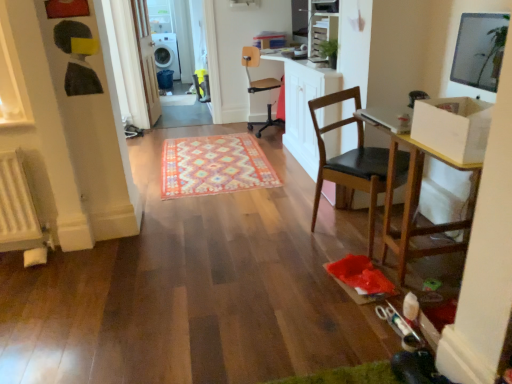
Question: Is white glossy dishwasher at upper left smaller than black leather chair at center, acting as the 2th chair starting from the top?

Choices:
 (A) yes
 (B) no

Answer: (B)

Question: Does white glossy dishwasher at upper left appear on the left side of black leather chair at center, which ranks as the 1th chair in bottom-to-top order?

Choices:
 (A) yes
 (B) no

Answer: (A)

Question: Can you confirm if white glossy dishwasher at upper left is shorter than black leather chair at center, which is the second chair from back to front?

Choices:
 (A) yes
 (B) no

Answer: (B)

Question: Is white glossy dishwasher at upper left completely or partially outside of black leather chair at center, which is the second chair from back to front?

Choices:
 (A) yes
 (B) no

Answer: (A)

Question: Does white glossy dishwasher at upper left have a larger size compared to black leather chair at center, which is the second chair from back to front?

Choices:
 (A) yes
 (B) no

Answer: (A)

Question: Is wooden table at right spatially inside beige leather office chair at center, which appears as the 2th chair when viewed from the front, or outside of it?

Choices:
 (A) inside
 (B) outside

Answer: (B)

Question: Is point (391, 114) positioned closer to the camera than point (247, 49)?

Choices:
 (A) closer
 (B) farther

Answer: (A)

Question: From the image's perspective, is wooden table at right located above or below beige leather office chair at center, arranged as the 2th chair when ordered from the bottom?

Choices:
 (A) above
 (B) below

Answer: (B)

Question: From a real-world perspective, relative to beige leather office chair at center, which is counted as the first chair, starting from the top, is wooden table at right vertically above or below?

Choices:
 (A) above
 (B) below

Answer: (B)

Question: From a real-world perspective, is black leather chair at center, which is the second chair from back to front, positioned above or below white glossy dishwasher at upper left?

Choices:
 (A) below
 (B) above

Answer: (A)

Question: Visually, is black leather chair at center, acting as the 2th chair starting from the top, positioned to the left or to the right of white glossy dishwasher at upper left?

Choices:
 (A) left
 (B) right

Answer: (B)

Question: Relative to white glossy dishwasher at upper left, is black leather chair at center, marked as the 1th chair in a front-to-back arrangement, in front or behind?

Choices:
 (A) behind
 (B) front

Answer: (B)

Question: Considering the positions of black leather chair at center, which is the second chair from back to front, and white glossy dishwasher at upper left in the image, is black leather chair at center, which is the second chair from back to front, bigger or smaller than white glossy dishwasher at upper left?

Choices:
 (A) small
 (B) big

Answer: (A)

Question: From the image's perspective, relative to multicolored woven rug at center, is white glossy dishwasher at upper left above or below?

Choices:
 (A) above
 (B) below

Answer: (A)

Question: Is white glossy dishwasher at upper left bigger or smaller than multicolored woven rug at center?

Choices:
 (A) big
 (B) small

Answer: (A)